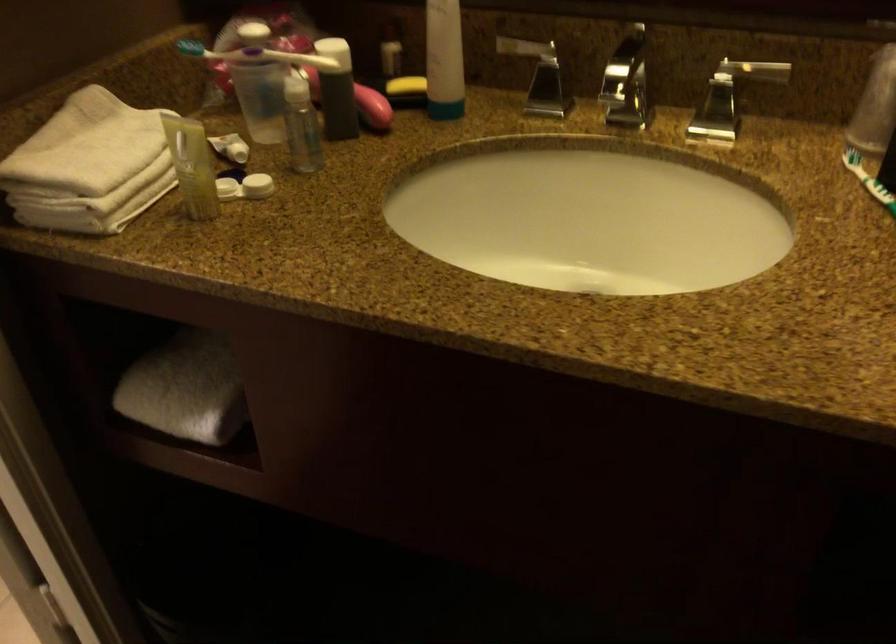
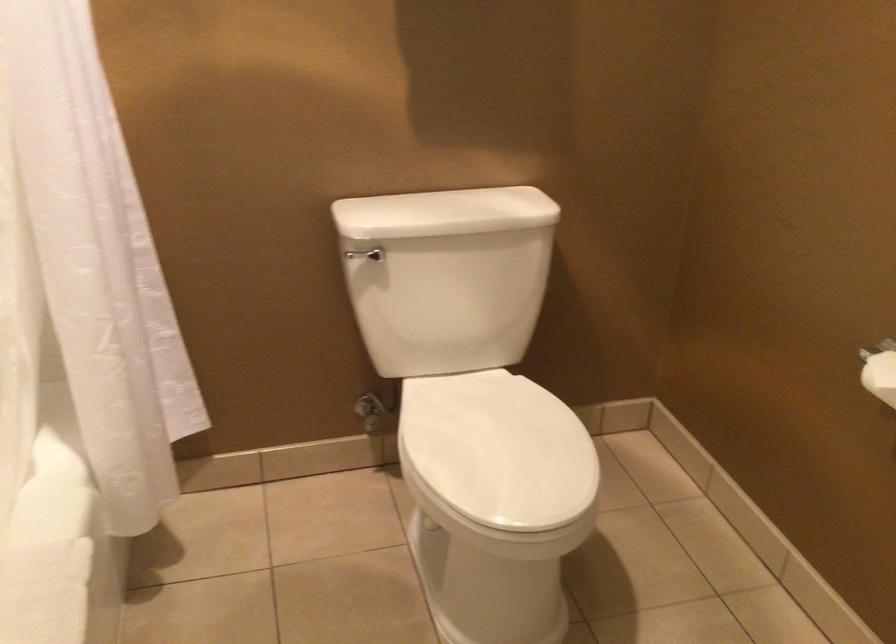
Question: The first image is from the beginning of the video and the second image is from the end. How did the camera likely rotate when shooting the video?

Choices:
 (A) Left
 (B) Right
 (C) Up
 (D) Down

Answer: (A)